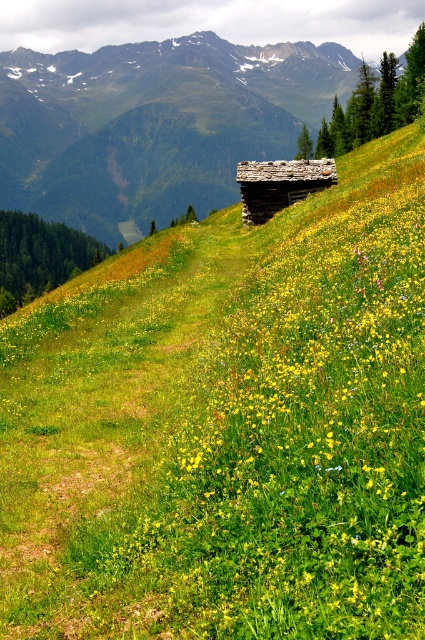
Is rustic wooden cabin at center positioned behind rustic wooden log cabin at center?

Yes, it is behind rustic wooden log cabin at center.

Is rustic wooden cabin at center in front of rustic wooden log cabin at center?

No, it is not.

Who is more forward, (79, 88) or (306, 193)?

Positioned in front is point (306, 193).

Locate an element on the screen. The width and height of the screenshot is (425, 640). rustic wooden cabin at center is located at coordinates (155, 124).